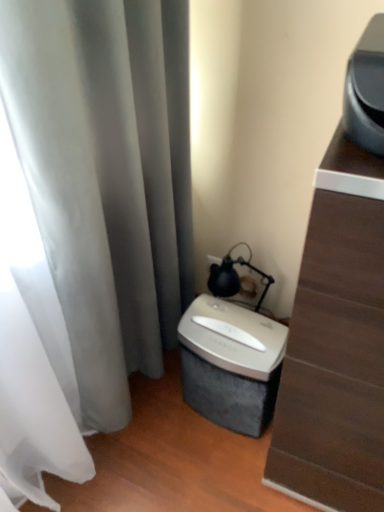
Question: Can you confirm if silver metallic shredder at lower center is positioned to the right of silver metallic shredder at lower center?

Choices:
 (A) yes
 (B) no

Answer: (B)

Question: Is the depth of silver metallic shredder at lower center greater than that of silver metallic shredder at lower center?

Choices:
 (A) yes
 (B) no

Answer: (A)

Question: Is silver metallic shredder at lower center oriented towards silver metallic shredder at lower center?

Choices:
 (A) yes
 (B) no

Answer: (B)

Question: Is silver metallic shredder at lower center thinner than silver metallic shredder at lower center?

Choices:
 (A) no
 (B) yes

Answer: (B)

Question: Is silver metallic shredder at lower center bigger than silver metallic shredder at lower center?

Choices:
 (A) yes
 (B) no

Answer: (B)

Question: In the image, is silver metallic shredder at lower center positioned in front of or behind matte black lamp at upper right?

Choices:
 (A) front
 (B) behind

Answer: (A)

Question: Is silver metallic shredder at lower center bigger or smaller than matte black lamp at upper right?

Choices:
 (A) big
 (B) small

Answer: (A)

Question: Considering the positions of silver metallic shredder at lower center and matte black lamp at upper right in the image, is silver metallic shredder at lower center taller or shorter than matte black lamp at upper right?

Choices:
 (A) short
 (B) tall

Answer: (B)

Question: In terms of width, does silver metallic shredder at lower center look wider or thinner when compared to matte black lamp at upper right?

Choices:
 (A) wide
 (B) thin

Answer: (A)

Question: Based on their positions, is silver metallic shredder at lower center located to the left or right of silver metallic shredder at lower center?

Choices:
 (A) right
 (B) left

Answer: (B)

Question: From their relative heights in the image, would you say silver metallic shredder at lower center is taller or shorter than silver metallic shredder at lower center?

Choices:
 (A) tall
 (B) short

Answer: (B)

Question: Do you think silver metallic shredder at lower center is within silver metallic shredder at lower center, or outside of it?

Choices:
 (A) inside
 (B) outside

Answer: (B)

Question: In the image, is silver metallic shredder at lower center positioned in front of or behind silver metallic shredder at lower center?

Choices:
 (A) front
 (B) behind

Answer: (B)

Question: From the image's perspective, is silver metallic shredder at lower center positioned above or below matte black lamp at upper right?

Choices:
 (A) below
 (B) above

Answer: (A)

Question: Based on their positions, is silver metallic shredder at lower center located to the left or right of matte black lamp at upper right?

Choices:
 (A) left
 (B) right

Answer: (A)